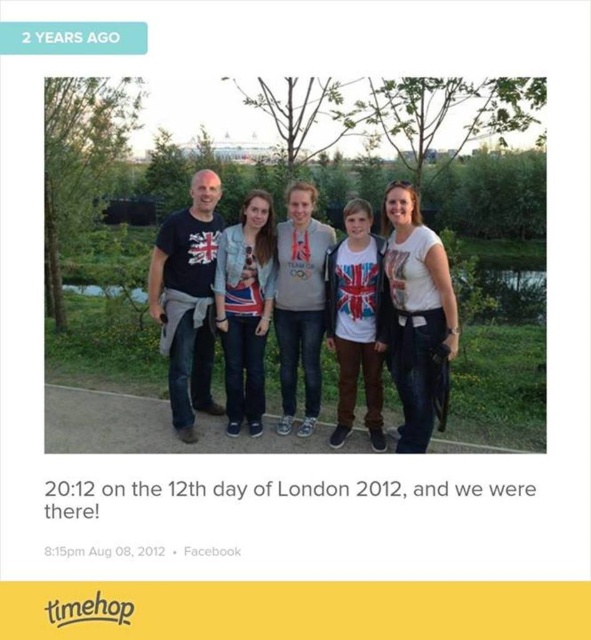
Does point (434, 268) lie behind point (264, 236)?

No, it is in front of (264, 236).

Between point (401, 387) and point (249, 387), which one is positioned behind?

Point (249, 387)

You are a GUI agent. You are given a task and a screenshot of the screen. Output one action in this format:
    pyautogui.click(x=<x>, y=<y>)
    Task: Click on the matte black t-shirt at center
    The image size is (591, 640).
    Given the screenshot: What is the action you would take?
    pyautogui.click(x=389, y=317)

Can you confirm if white cotton t-shirt at center is wider than denim jacket at center?

Yes.

Is white cotton t-shirt at center smaller than denim jacket at center?

No, white cotton t-shirt at center is not smaller than denim jacket at center.

The width and height of the screenshot is (591, 640). Identify the location of white cotton t-shirt at center. (417, 312).

Find the location of a particular element. matte black t-shirt at center is located at coordinates (389, 317).

Is point (352, 227) positioned before point (410, 204)?

No, (352, 227) is further to viewer.

Identify the location of matte black t-shirt at center. This screenshot has width=591, height=640. (389, 317).